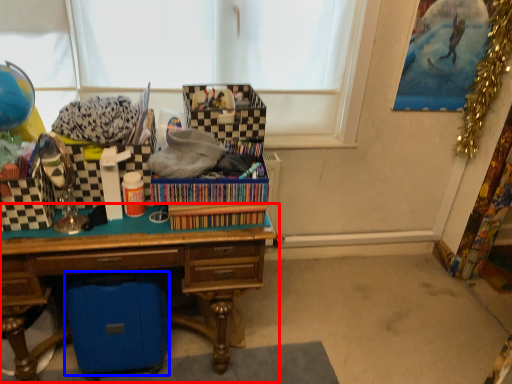
Question: Which point is closer to the camera, desk (highlighted by a red box) or storage box (highlighted by a blue box)?

Choices:
 (A) desk
 (B) storage box

Answer: (A)